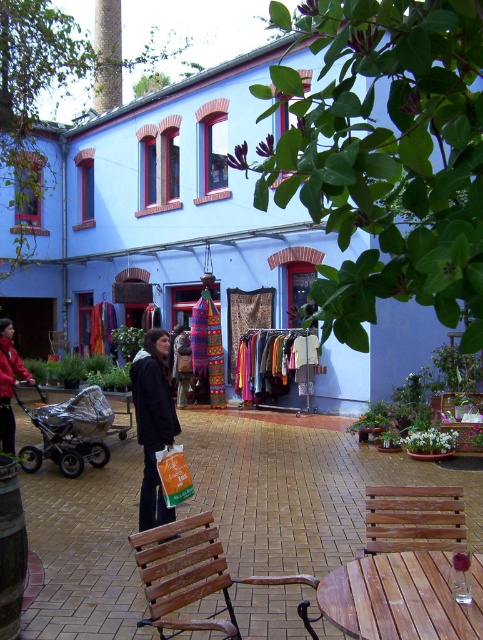
Question: Estimate the real-world distances between objects in this image. Which object is farther from the black fabric bag at center?

Choices:
 (A) wooden bench at center
 (B) matte black stroller at left
 (C) wooden bench at lower center

Answer: (B)

Question: Estimate the real-world distances between objects in this image. Which object is farther from the wooden bench at center?

Choices:
 (A) black fabric bag at center
 (B) matte black stroller at left
 (C) red fleece jacket at left

Answer: (C)

Question: Is wooden bench at center positioned before black fabric bag at center?

Choices:
 (A) yes
 (B) no

Answer: (A)

Question: Can you confirm if wooden bench at center is bigger than black fabric bag at center?

Choices:
 (A) no
 (B) yes

Answer: (B)

Question: Is wooden bench at lower center smaller than red fleece jacket at left?

Choices:
 (A) yes
 (B) no

Answer: (A)

Question: Which object is closer to the camera taking this photo?

Choices:
 (A) matte black stroller at left
 (B) black fabric bag at center

Answer: (B)